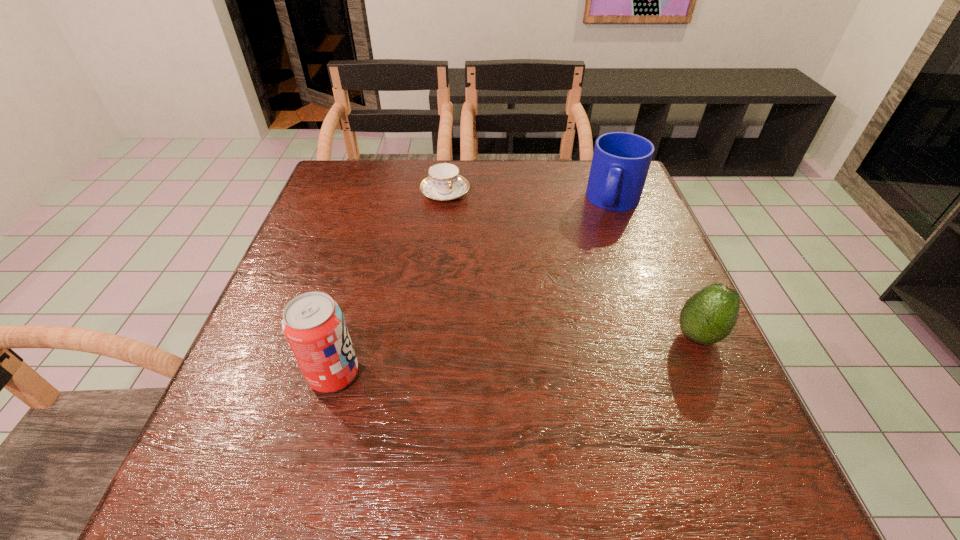
In order to click on free space that is in between the mug and the soda can in this screenshot , I will do `click(474, 288)`.

Identify the location of vacant point located between the avocado and the shortest object. (571, 265).

At what (x,y) coordinates should I click in order to perform the action: click on free space between the soda can and the avocado. Please return your answer as a coordinate pair (x, y). Looking at the image, I should click on (x=516, y=355).

I want to click on vacant space that's between the leftmost object and the avocado, so click(x=516, y=355).

Image resolution: width=960 pixels, height=540 pixels. Identify the location of empty location between the avocado and the soda can. (516, 355).

Locate an element on the screen. vacant area between the avocado and the third object from right to left is located at coordinates (571, 265).

The height and width of the screenshot is (540, 960). Find the location of `vacant area that lies between the mug and the leftmost object`. vacant area that lies between the mug and the leftmost object is located at coordinates (474, 288).

This screenshot has width=960, height=540. What are the coordinates of `object that is the second closest to the mug` in the screenshot? It's located at (444, 183).

Locate an element on the screen. Image resolution: width=960 pixels, height=540 pixels. object that is the second closest one to the second object from left to right is located at coordinates (313, 323).

Locate an element on the screen. The image size is (960, 540). vacant position in the image that satisfies the following two spatial constraints: 1. on the back side of the leftmost object; 2. on the left side of the mug is located at coordinates (382, 201).